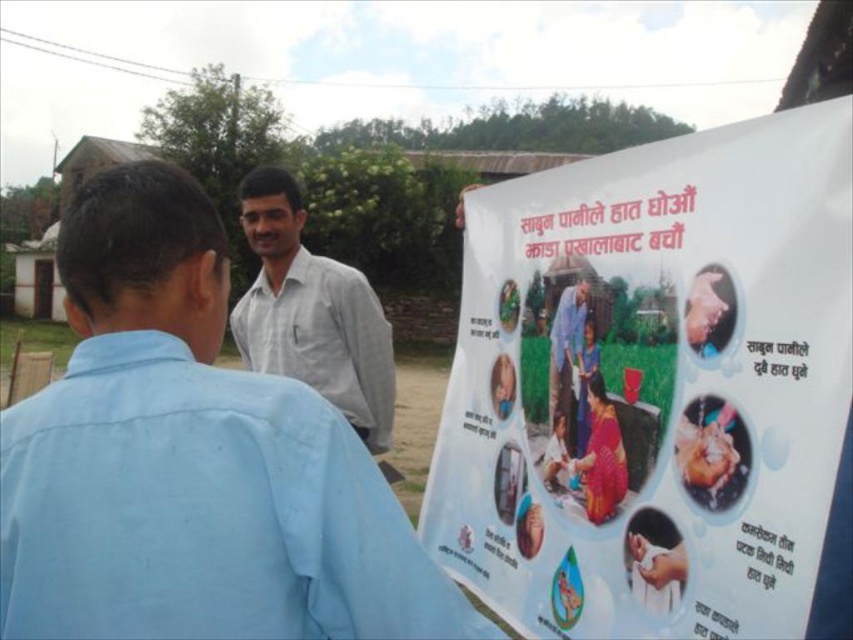
This screenshot has height=640, width=853. What do you see at coordinates (654, 388) in the screenshot?
I see `white paper poster at upper right` at bounding box center [654, 388].

Is white paper poster at upper right smaller than gray checkered shirt at center?

Incorrect, white paper poster at upper right is not smaller in size than gray checkered shirt at center.

Does point (817, 513) come closer to viewer compared to point (329, 288)?

Yes, point (817, 513) is in front of point (329, 288).

Where is `white paper poster at upper right`? This screenshot has height=640, width=853. white paper poster at upper right is located at coordinates (654, 388).

Can you confirm if white cotton shirt at upper center is positioned above smooth skin hand at center?

Result: No, white cotton shirt at upper center is not above smooth skin hand at center.

Is white cotton shirt at upper center bigger than smooth skin hand at center?

Yes.

Between point (155, 440) and point (711, 339), which one is positioned in front?

Point (155, 440) is more forward.

The height and width of the screenshot is (640, 853). I want to click on white cotton shirt at upper center, so click(190, 460).

Does gray checkered shirt at center have a smaller size compared to smooth skin hand at center?

No, gray checkered shirt at center is not smaller than smooth skin hand at center.

Does gray checkered shirt at center appear on the right side of smooth skin hand at center?

In fact, gray checkered shirt at center is to the left of smooth skin hand at center.

At what (x,y) coordinates should I click in order to perform the action: click on gray checkered shirt at center. Please return your answer as a coordinate pair (x, y). Looking at the image, I should click on (311, 312).